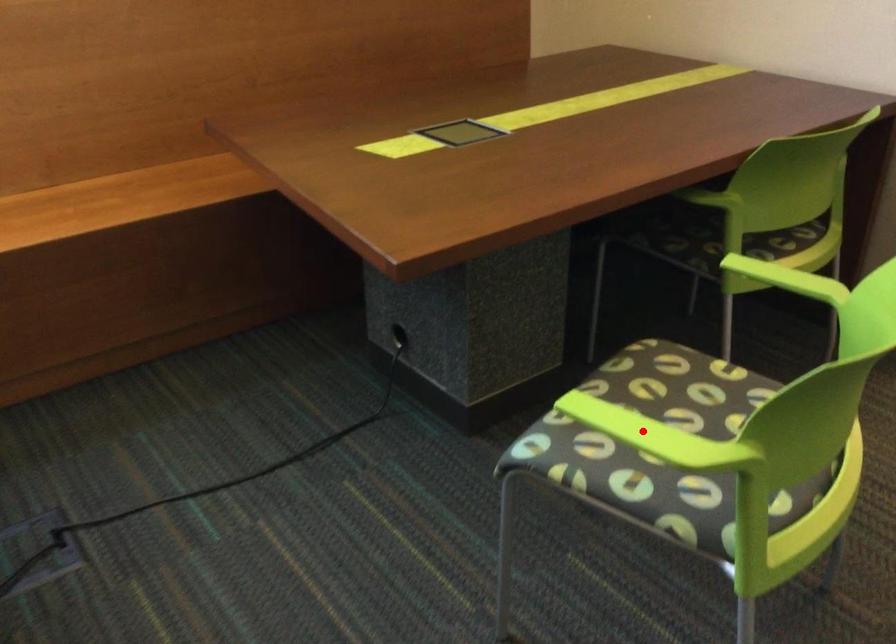
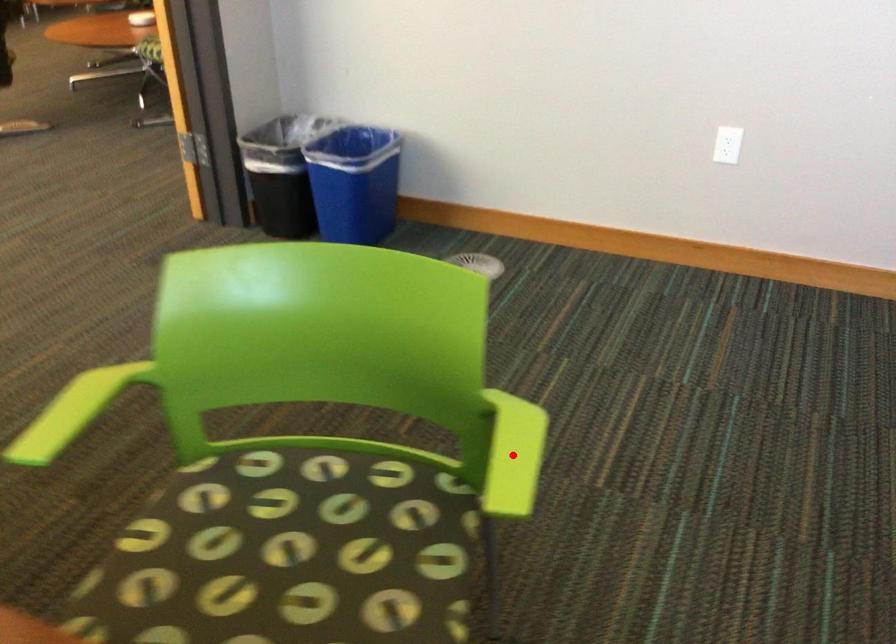
I am providing you with two images of the same scene from different viewpoints. A red point is marked on the first image and another point is marked on the second image. Does the point marked in image1 correspond to the same location as the one in image2?

Yes